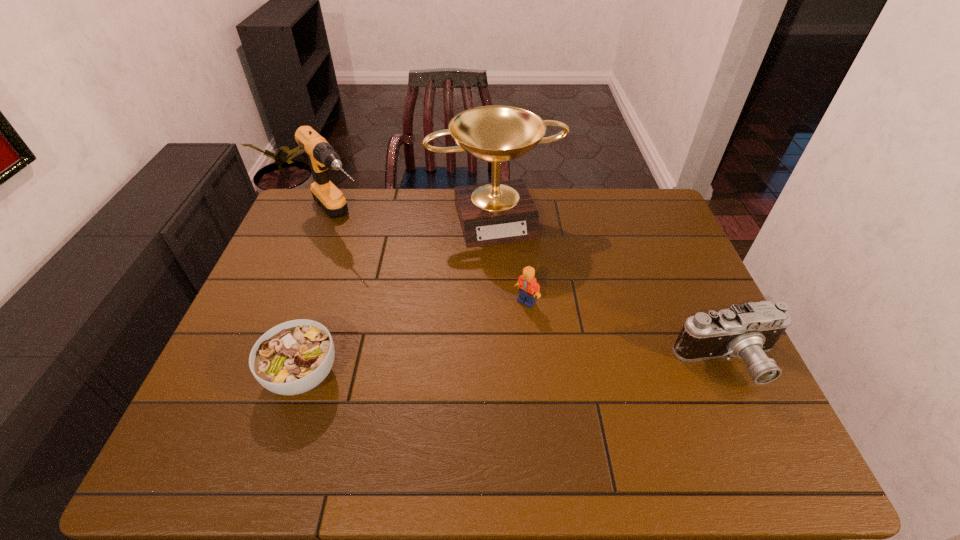
This screenshot has width=960, height=540. In the image, there is a desktop. Identify the location of free region at the far right corner. (647, 206).

Where is `vacant region between the award and the shortest object`? vacant region between the award and the shortest object is located at coordinates 399,296.

At what (x,y) coordinates should I click in order to perform the action: click on free spot between the award and the drill. Please return your answer as a coordinate pair (x, y). Looking at the image, I should click on (419, 218).

At what (x,y) coordinates should I click in order to perform the action: click on vacant area between the award and the drill. Please return your answer as a coordinate pair (x, y). Looking at the image, I should click on (419, 218).

The image size is (960, 540). I want to click on vacant region between the award and the third farthest object, so click(511, 259).

Locate an element on the screen. free space between the rightmost object and the soup bowl is located at coordinates (516, 368).

This screenshot has width=960, height=540. I want to click on free space between the Lego and the rightmost object, so click(627, 332).

Locate an element on the screen. vacant area between the shortest object and the drill is located at coordinates (323, 296).

I want to click on vacant area that lies between the drill and the third nearest object, so click(x=434, y=260).

Image resolution: width=960 pixels, height=540 pixels. What are the coordinates of `vacant area between the Lego and the shortest object` in the screenshot? It's located at (415, 338).